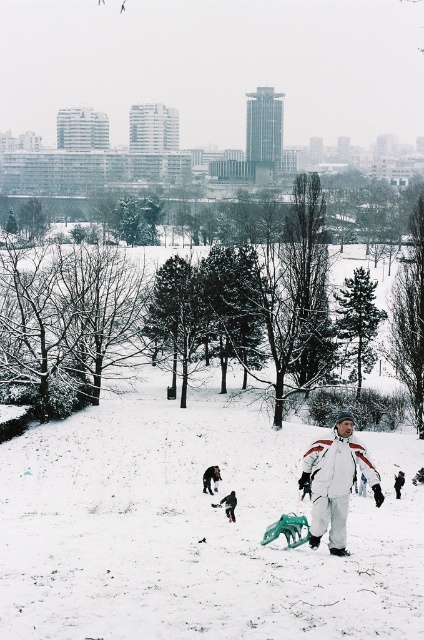
Question: Among these points, which one is nearest to the camera?

Choices:
 (A) pos(164,474)
 (B) pos(395,480)

Answer: (B)

Question: Is dark gray snowsuit at lower center closer to camera compared to white snowsuit at center?

Choices:
 (A) yes
 (B) no

Answer: (A)

Question: Is white matte snowsuit at center to the left of white snowsuit at center from the viewer's perspective?

Choices:
 (A) no
 (B) yes

Answer: (B)

Question: Is white matte snowsuit at center positioned behind dark fur coat at lower center?

Choices:
 (A) yes
 (B) no

Answer: (B)

Question: Among these objects, which one is nearest to the camera?

Choices:
 (A) white matte snowsuit at center
 (B) white fluffy snow at center

Answer: (B)

Question: Based on their relative distances, which object is nearer to the white snowsuit at center?

Choices:
 (A) dark fur coat at lower center
 (B) dark gray snowsuit at lower center
 (C) white fluffy snow at center

Answer: (A)